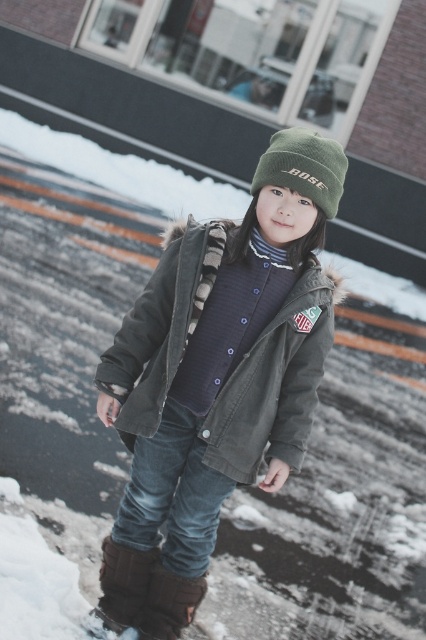
Question: Which point is farther to the camera?

Choices:
 (A) brown suede boot at lower left
 (B) brown suede boot at lower center

Answer: (A)

Question: Which of the following is the farthest from the observer?

Choices:
 (A) olive corduroy jacket at center
 (B) green knit beanie at center
 (C) brown suede boot at lower center

Answer: (C)

Question: Does olive corduroy jacket at center have a lesser width compared to green knit beanie at center?

Choices:
 (A) yes
 (B) no

Answer: (B)

Question: Is brown suede boot at lower left positioned at the back of brown suede boot at lower center?

Choices:
 (A) yes
 (B) no

Answer: (A)

Question: Does green knit beanie at center have a greater width compared to brown suede boot at lower center?

Choices:
 (A) yes
 (B) no

Answer: (A)

Question: Which is nearer to the brown suede boot at lower left?

Choices:
 (A) brown suede boot at lower center
 (B) olive corduroy jacket at center
 (C) green knit beanie at center

Answer: (A)